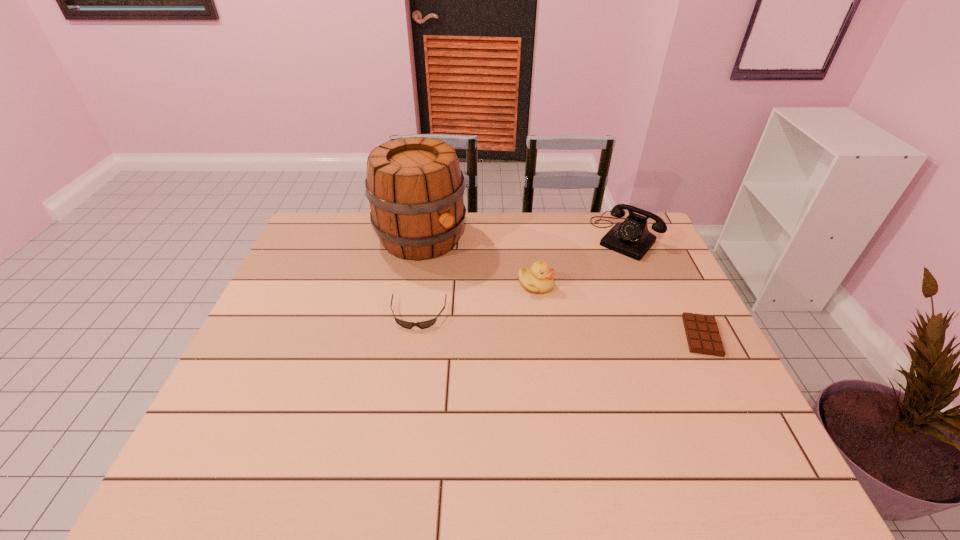
The height and width of the screenshot is (540, 960). In order to click on vacant space on the desktop that is between the fourth tallest object and the shortest object and is positioned on the front face of the telephone in this screenshot , I will do `click(548, 324)`.

At what (x,y) coordinates should I click in order to perform the action: click on free space on the desktop that is between the sunglasses and the candy bar and is positioned on the side of the tallest object where the spigot is located. Please return your answer as a coordinate pair (x, y). The height and width of the screenshot is (540, 960). Looking at the image, I should click on (525, 322).

Image resolution: width=960 pixels, height=540 pixels. I want to click on vacant space on the desktop that is between the sunglasses and the shortest object and is positioned on the beak of the third nearest object, so click(582, 327).